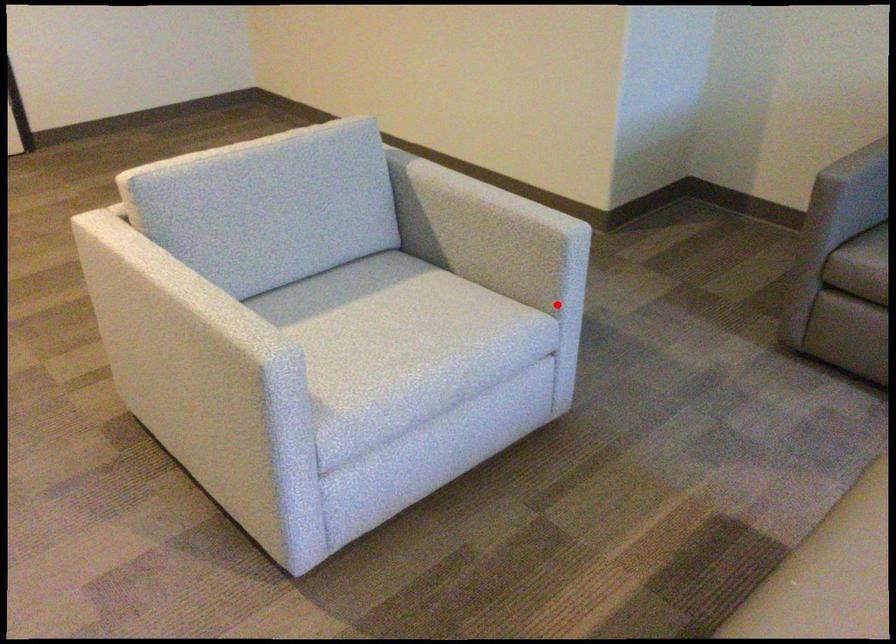
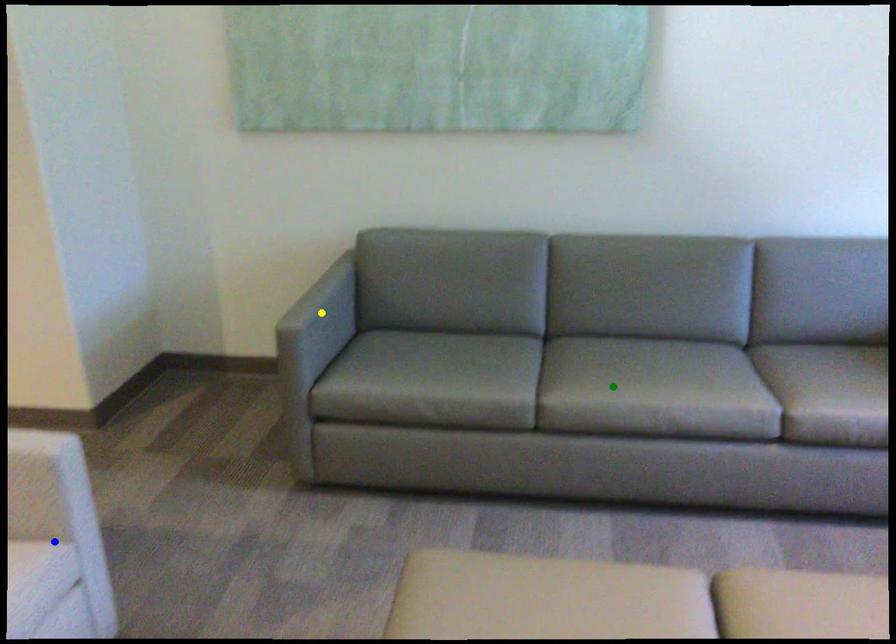
Question: I am providing you with two images of the same scene from different viewpoints. A red point is marked on the first image. You are given multiple points on the second image. Which mark in image 2 goes with the point in image 1?

Choices:
 (A) yellow point
 (B) blue point
 (C) green point

Answer: (B)